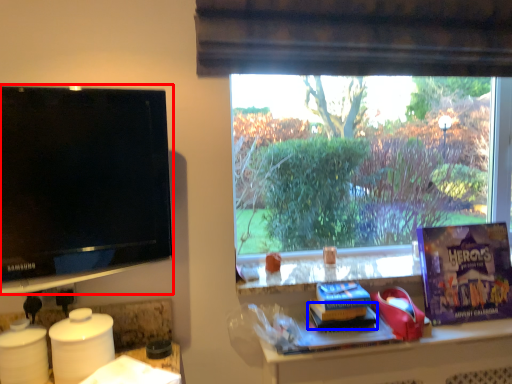
Question: Which point is further to the camera, television (highlighted by a red box) or book (highlighted by a blue box)?

Choices:
 (A) television
 (B) book

Answer: (B)